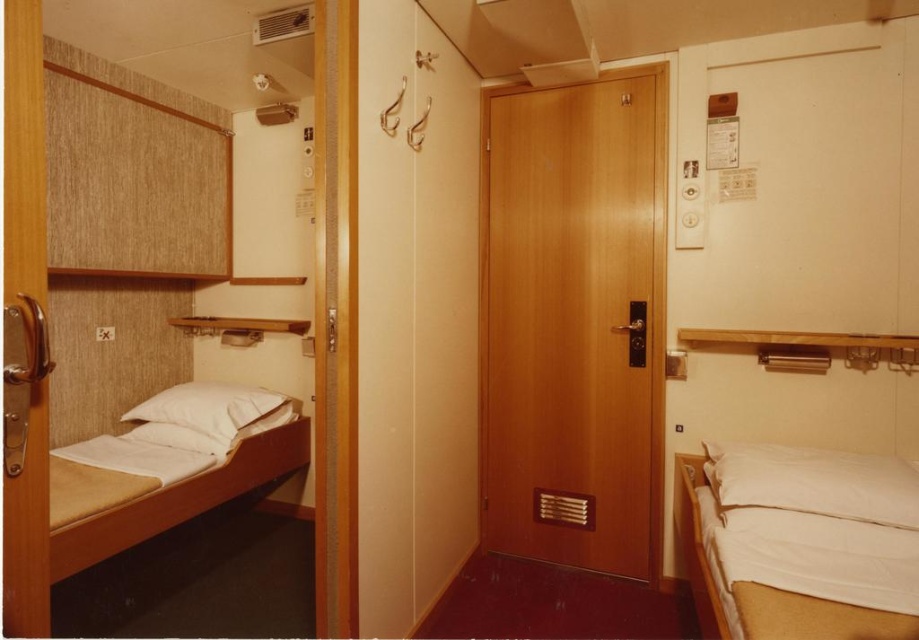
You are standing in the center of the room. The white matte bed at left is represented by point (163, 477). Which direction should you walk to reach the white matte bed at left?

Since the white matte bed at left is represented by point (163, 477), you should walk to the left to reach it.

You are staying in a small room with two beds. You need to place a nightstand between the white matte bed at right and the white matte bed at left. Based on their positions, which bed should the nightstand be closer to?

The nightstand should be placed closer to the white matte bed at left because the white matte bed at right is positioned to the right of the white matte bed at left, meaning there might be less space between them on the right side.

You are a guest in this room and want to place a tall lamp on the bed that is taller. Which bed should you choose between the white matte bed at right and the white matte bed at left?

The white matte bed at right is taller than the white matte bed at left, so you should choose the white matte bed at right to place the tall lamp.